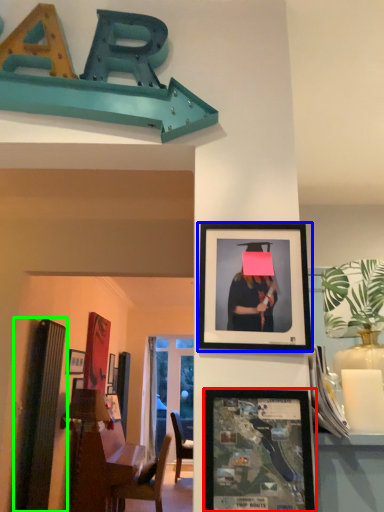
Question: Estimate the real-world distances between objects in this image. Which object is closer to picture frame (highlighted by a red box), picture frame (highlighted by a blue box) or bulletin board (highlighted by a green box)?

Choices:
 (A) picture frame
 (B) bulletin board

Answer: (A)